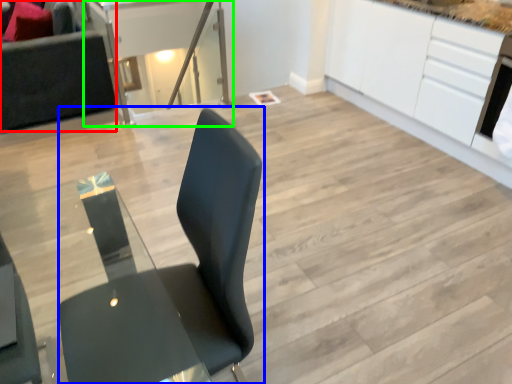
Question: Which is nearer to the couch (highlighted by a red box)? chair (highlighted by a blue box) or table (highlighted by a green box).

Choices:
 (A) chair
 (B) table

Answer: (B)